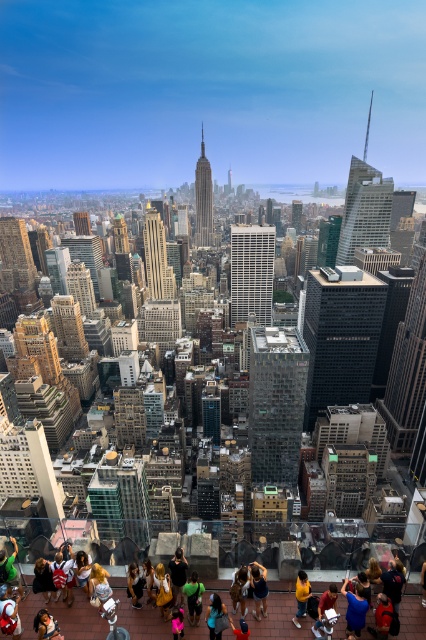
Question: Does matte black hair at lower left come in front of blue denim jeans at lower center?

Choices:
 (A) no
 (B) yes

Answer: (B)

Question: Which of the following is the closest to the observer?

Choices:
 (A) (192, 588)
 (B) (296, 593)

Answer: (A)

Question: Which object is positioned closest to the matte black laptop at lower center?

Choices:
 (A) blue denim jeans at lower right
 (B) dark blue shirt at center

Answer: (A)

Question: Is blue denim jeans at lower right thinner than matte black hair at lower left?

Choices:
 (A) yes
 (B) no

Answer: (A)

Question: Which of these objects is positioned closest to the dark gray hoodie at center?

Choices:
 (A) dark blue shirt at center
 (B) green fabric shirt at center
 (C) blue denim jeans at lower center
 (D) blue denim jeans at lower right

Answer: (B)

Question: Is dark blue shirt at center bigger than yellow matte shirt at center?

Choices:
 (A) no
 (B) yes

Answer: (A)